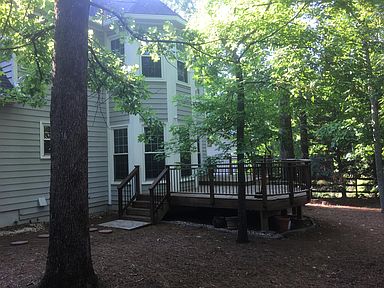
The width and height of the screenshot is (384, 288). Find the location of `ground covering`. ground covering is located at coordinates (21, 267), (101, 244), (143, 284), (179, 236), (226, 278), (291, 248), (338, 284), (379, 256), (346, 218).